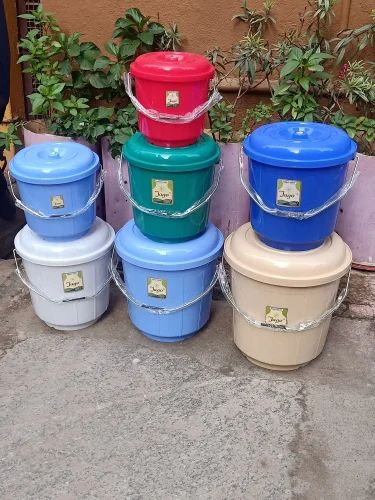
Locate an element on the screen. The width and height of the screenshot is (375, 500). handles is located at coordinates (52, 217), (171, 117), (160, 212), (80, 295), (159, 309), (284, 327), (295, 210).